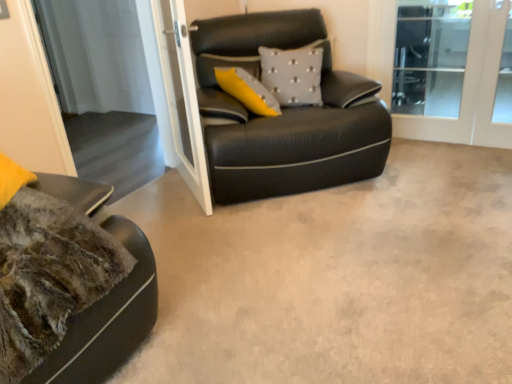
Question: Is black leather studio couch at center facing towards white glass screen door at upper center, the second screen door viewed from the right?

Choices:
 (A) yes
 (B) no

Answer: (B)

Question: Is black leather studio couch at center surrounding white glass screen door at upper center, which is the second screen door from left to right?

Choices:
 (A) yes
 (B) no

Answer: (B)

Question: Considering the relative sizes of black leather studio couch at center and white glass screen door at upper center, which is the second screen door from left to right, in the image provided, is black leather studio couch at center wider than white glass screen door at upper center, which is the second screen door from left to right,?

Choices:
 (A) no
 (B) yes

Answer: (B)

Question: From the image's perspective, is black leather studio couch at center located beneath white glass screen door at upper center, which is the second screen door from left to right?

Choices:
 (A) no
 (B) yes

Answer: (A)

Question: Are black leather studio couch at center and white glass screen door at upper center, which is the second screen door from left to right, making contact?

Choices:
 (A) yes
 (B) no

Answer: (B)

Question: Does black leather studio couch at center appear on the right side of white glass screen door at upper center, which is the second screen door from left to right?

Choices:
 (A) no
 (B) yes

Answer: (B)

Question: Considering the relative sizes of transparent glass screen door at upper center, which is the 3th screen door in right-to-left order, and black leather studio couch at center in the image provided, is transparent glass screen door at upper center, which is the 3th screen door in right-to-left order, taller than black leather studio couch at center?

Choices:
 (A) yes
 (B) no

Answer: (A)

Question: Can you confirm if transparent glass screen door at upper center, which is the 3th screen door in right-to-left order, is smaller than black leather studio couch at center?

Choices:
 (A) no
 (B) yes

Answer: (B)

Question: Considering the relative positions of transparent glass screen door at upper center, acting as the 1th screen door starting from the left, and black leather studio couch at center in the image provided, is transparent glass screen door at upper center, acting as the 1th screen door starting from the left, to the right of black leather studio couch at center from the viewer's perspective?

Choices:
 (A) yes
 (B) no

Answer: (B)

Question: Is transparent glass screen door at upper center, acting as the 1th screen door starting from the left, at the left side of black leather studio couch at center?

Choices:
 (A) no
 (B) yes

Answer: (B)

Question: From a real-world perspective, is transparent glass screen door at upper center, acting as the 1th screen door starting from the left, over black leather studio couch at center?

Choices:
 (A) yes
 (B) no

Answer: (A)

Question: Does transparent glass screen door at upper center, acting as the 1th screen door starting from the left, have a lesser width compared to black leather studio couch at center?

Choices:
 (A) no
 (B) yes

Answer: (B)

Question: Is gray textured pillow at center positioned beyond the bounds of transparent glass screen door at upper center, acting as the 1th screen door starting from the left?

Choices:
 (A) no
 (B) yes

Answer: (B)